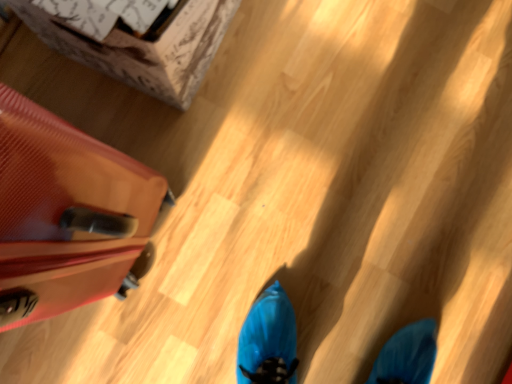
Question: Is brown cardboard box at upper left placed right next to matte red suitcase at left?

Choices:
 (A) no
 (B) yes

Answer: (A)

Question: Considering the relative sizes of brown cardboard box at upper left and matte red suitcase at left in the image provided, is brown cardboard box at upper left shorter than matte red suitcase at left?

Choices:
 (A) no
 (B) yes

Answer: (B)

Question: Does brown cardboard box at upper left have a lesser width compared to matte red suitcase at left?

Choices:
 (A) yes
 (B) no

Answer: (A)

Question: From a real-world perspective, is brown cardboard box at upper left positioned under matte red suitcase at left based on gravity?

Choices:
 (A) yes
 (B) no

Answer: (A)

Question: Can you confirm if brown cardboard box at upper left is taller than matte red suitcase at left?

Choices:
 (A) yes
 (B) no

Answer: (B)

Question: Does brown cardboard box at upper left appear on the right side of matte red suitcase at left?

Choices:
 (A) no
 (B) yes

Answer: (B)

Question: Is matte red suitcase at left in front of brown cardboard box at upper left?

Choices:
 (A) no
 (B) yes

Answer: (B)

Question: Does matte red suitcase at left appear on the left side of brown cardboard box at upper left?

Choices:
 (A) no
 (B) yes

Answer: (B)

Question: Considering the relative sizes of matte red suitcase at left and brown cardboard box at upper left in the image provided, is matte red suitcase at left shorter than brown cardboard box at upper left?

Choices:
 (A) no
 (B) yes

Answer: (A)

Question: Could you tell me if matte red suitcase at left is facing brown cardboard box at upper left?

Choices:
 (A) no
 (B) yes

Answer: (A)

Question: Does matte red suitcase at left have a greater height compared to brown cardboard box at upper left?

Choices:
 (A) yes
 (B) no

Answer: (A)

Question: Considering the relative sizes of matte red suitcase at left and brown cardboard box at upper left in the image provided, is matte red suitcase at left thinner than brown cardboard box at upper left?

Choices:
 (A) yes
 (B) no

Answer: (B)

Question: Is point (93, 296) positioned closer to the camera than point (215, 39)?

Choices:
 (A) closer
 (B) farther

Answer: (A)